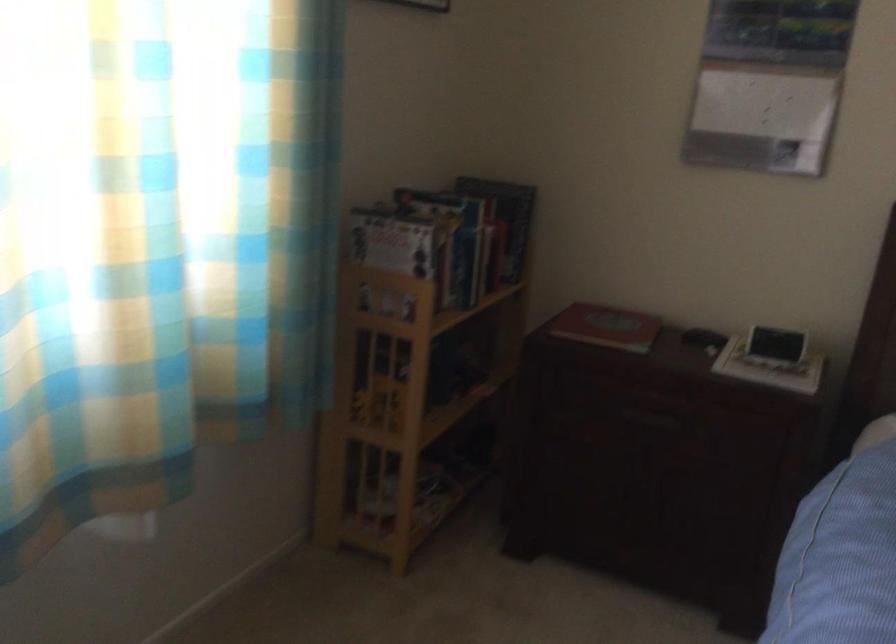
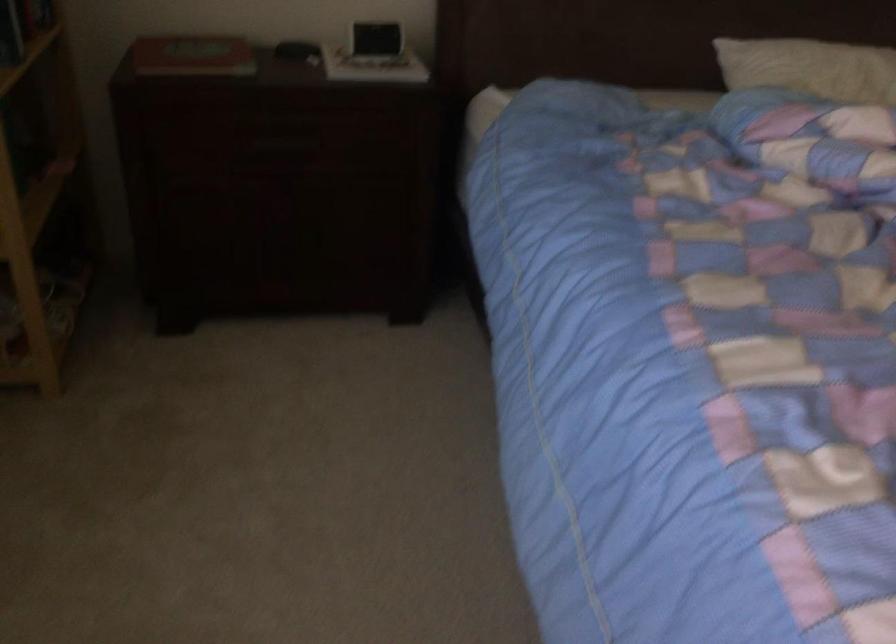
The images are taken continuously from a first-person perspective. In which direction is your viewpoint rotating?

The rotation direction of the camera is right-down.